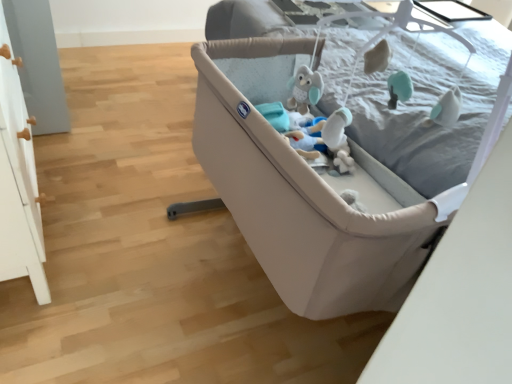
Question: Considering the relative sizes of white plush toy at center and soft gray fabric mattress at upper right in the image provided, is white plush toy at center taller than soft gray fabric mattress at upper right?

Choices:
 (A) no
 (B) yes

Answer: (A)

Question: Is white plush toy at center aimed at soft gray fabric mattress at upper right?

Choices:
 (A) no
 (B) yes

Answer: (A)

Question: Does white plush toy at center have a lesser width compared to soft gray fabric mattress at upper right?

Choices:
 (A) yes
 (B) no

Answer: (A)

Question: Is white plush toy at center positioned behind soft gray fabric mattress at upper right?

Choices:
 (A) no
 (B) yes

Answer: (B)

Question: Is white plush toy at center to the right of soft gray fabric mattress at upper right from the viewer's perspective?

Choices:
 (A) yes
 (B) no

Answer: (B)

Question: From a real-world perspective, is white plush toy at center beneath soft gray fabric mattress at upper right?

Choices:
 (A) yes
 (B) no

Answer: (A)

Question: Is beige fabric crib at center thinner than white plush toy at center?

Choices:
 (A) no
 (B) yes

Answer: (A)

Question: Is beige fabric crib at center to the left of white plush toy at center from the viewer's perspective?

Choices:
 (A) yes
 (B) no

Answer: (A)

Question: Is beige fabric crib at center further to the viewer compared to white plush toy at center?

Choices:
 (A) no
 (B) yes

Answer: (A)

Question: From a real-world perspective, is beige fabric crib at center positioned over white plush toy at center based on gravity?

Choices:
 (A) no
 (B) yes

Answer: (A)

Question: Is beige fabric crib at center placed right next to white plush toy at center?

Choices:
 (A) yes
 (B) no

Answer: (B)

Question: Is white plush toy at center at the back of beige fabric crib at center?

Choices:
 (A) yes
 (B) no

Answer: (B)

Question: From a real-world perspective, is beige fabric crib at center physically below soft gray fabric mattress at upper right?

Choices:
 (A) no
 (B) yes

Answer: (B)